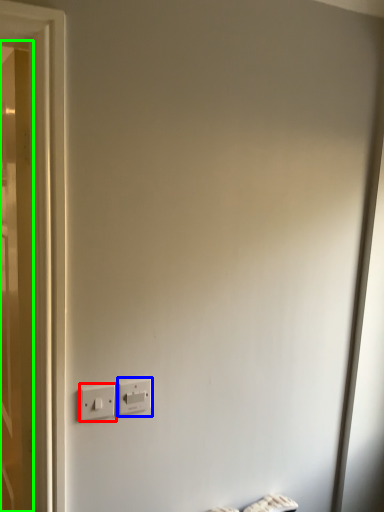
Question: Based on their relative distances, which object is farther from power plugs and sockets (highlighted by a red box)? Choose from power plugs and sockets (highlighted by a blue box) and door (highlighted by a green box).

Choices:
 (A) power plugs and sockets
 (B) door

Answer: (B)